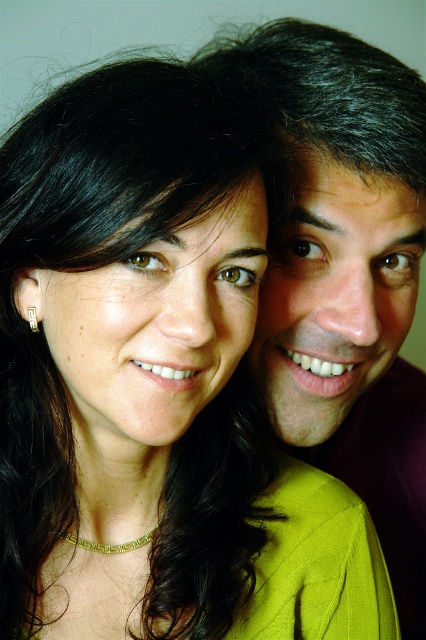
Question: Does gold textured necklace at lower center have a larger size compared to gold textured square at left?

Choices:
 (A) yes
 (B) no

Answer: (A)

Question: Which of the following is the closest to the observer?

Choices:
 (A) gold textured square at left
 (B) gold textured necklace at lower center

Answer: (A)

Question: In this image, where is gold textured necklace at lower center located relative to gold textured square at left?

Choices:
 (A) above
 (B) below

Answer: (B)

Question: Can you confirm if gold textured necklace at lower center is wider than gold textured square at left?

Choices:
 (A) yes
 (B) no

Answer: (A)

Question: Which point is farther from the camera taking this photo?

Choices:
 (A) click(77, 545)
 (B) click(34, 326)

Answer: (A)